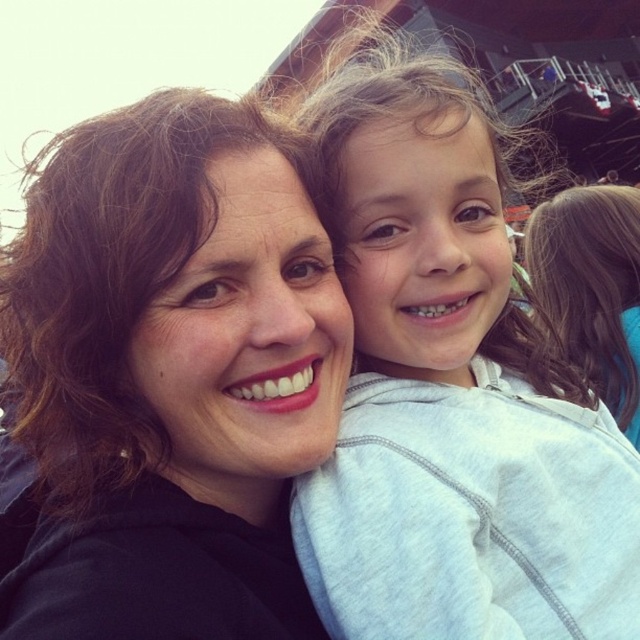
You are a fashion designer who wants to create a new line of hoodies. You have two hoodies in front of you, the matte black hoodie at center and the gray cotton hoodie at upper right. Which one is more suitable for a winter collection if you want a thicker material?

The gray cotton hoodie at upper right is thicker than the matte black hoodie at center, so it is more suitable for a winter collection.

You are a photographer trying to capture both the matte black hoodie at center and the gray cotton hoodie at upper right in the same frame. Which hoodie should you focus on first if you want to ensure both are in focus, considering their sizes?

The matte black hoodie at center is not as tall as gray cotton hoodie at upper right, so you should focus on the gray cotton hoodie at upper right first since it is taller and might require more precise focusing to capture details.